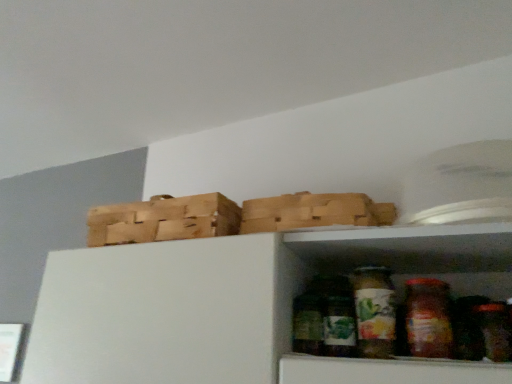
Question: Does green matte glass jar at lower center, the second glass jar in the right-to-left sequence, have a greater width compared to translucent glass jar at center, which ranks as the first glass jar in right-to-left order?

Choices:
 (A) yes
 (B) no

Answer: (A)

Question: Is green matte glass jar at lower center, positioned as the 1th glass jar in left-to-right order, at the right side of translucent glass jar at center, positioned as the 2th glass jar in left-to-right order?

Choices:
 (A) no
 (B) yes

Answer: (A)

Question: Can you confirm if green matte glass jar at lower center, positioned as the 1th glass jar in left-to-right order, is thinner than translucent glass jar at center, positioned as the 2th glass jar in left-to-right order?

Choices:
 (A) yes
 (B) no

Answer: (B)

Question: From the image's perspective, does green matte glass jar at lower center, the second glass jar in the right-to-left sequence, appear higher than translucent glass jar at center, positioned as the 2th glass jar in left-to-right order?

Choices:
 (A) no
 (B) yes

Answer: (A)

Question: Are green matte glass jar at lower center, positioned as the 1th glass jar in left-to-right order, and translucent glass jar at center, positioned as the 2th glass jar in left-to-right order, making contact?

Choices:
 (A) yes
 (B) no

Answer: (A)

Question: Does green matte glass jar at lower center, positioned as the 1th glass jar in left-to-right order, turn towards translucent glass jar at center, positioned as the 2th glass jar in left-to-right order?

Choices:
 (A) no
 (B) yes

Answer: (A)

Question: From the image's perspective, would you say wooden crate at upper left is shown under green matte glass jar at lower center, the second glass jar in the right-to-left sequence?

Choices:
 (A) no
 (B) yes

Answer: (A)

Question: Is wooden crate at upper left positioned beyond the bounds of green matte glass jar at lower center, the second glass jar in the right-to-left sequence?

Choices:
 (A) yes
 (B) no

Answer: (A)

Question: Can you confirm if wooden crate at upper left is bigger than green matte glass jar at lower center, positioned as the 1th glass jar in left-to-right order?

Choices:
 (A) no
 (B) yes

Answer: (B)

Question: Is wooden crate at upper left positioned behind green matte glass jar at lower center, positioned as the 1th glass jar in left-to-right order?

Choices:
 (A) no
 (B) yes

Answer: (B)

Question: Considering the relative sizes of wooden crate at upper left and green matte glass jar at lower center, positioned as the 1th glass jar in left-to-right order, in the image provided, is wooden crate at upper left thinner than green matte glass jar at lower center, positioned as the 1th glass jar in left-to-right order,?

Choices:
 (A) yes
 (B) no

Answer: (B)

Question: Is wooden crate at upper left far away from green matte glass jar at lower center, the second glass jar in the right-to-left sequence?

Choices:
 (A) no
 (B) yes

Answer: (A)

Question: From a real-world perspective, is green matte glass jar at lower center, the second glass jar in the right-to-left sequence, physically below wooden crate at upper left?

Choices:
 (A) yes
 (B) no

Answer: (A)